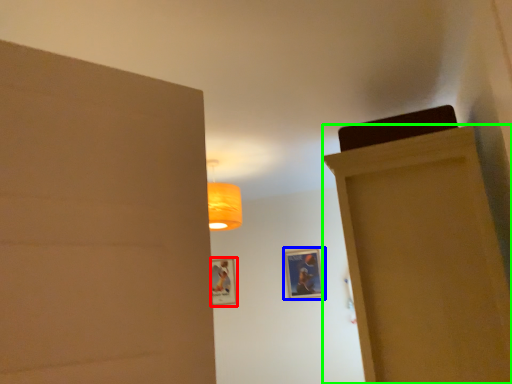
Question: Estimate the real-world distances between objects in this image. Which object is closer to picture frame (highlighted by a red box), picture frame (highlighted by a blue box) or door (highlighted by a green box)?

Choices:
 (A) picture frame
 (B) door

Answer: (A)